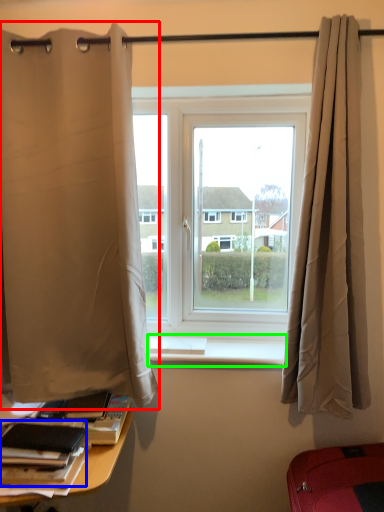
Question: Which object is the closest to the curtain (highlighted by a red box)? Choose among these: book (highlighted by a blue box) or window sill (highlighted by a green box).

Choices:
 (A) book
 (B) window sill

Answer: (B)